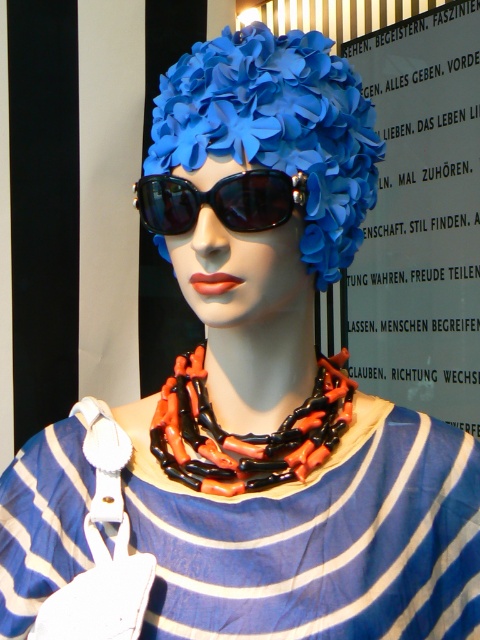
Question: Does matte plastic flowers at center appear over orange-black beaded necklace at center?

Choices:
 (A) no
 (B) yes

Answer: (B)

Question: Considering the relative positions of orange-black beaded necklace at center and black glossy sunglasses at center in the image provided, where is orange-black beaded necklace at center located with respect to black glossy sunglasses at center?

Choices:
 (A) right
 (B) left

Answer: (A)

Question: Which object is farther from the camera taking this photo?

Choices:
 (A) orange-black beaded necklace at center
 (B) black glossy sunglasses at center

Answer: (A)

Question: Which object is positioned closest to the blue striped fabric dress at center?

Choices:
 (A) matte plastic flowers at center
 (B) black glossy sunglasses at center

Answer: (A)

Question: Is orange-black beaded necklace at center to the right of black glossy sunglasses at center from the viewer's perspective?

Choices:
 (A) no
 (B) yes

Answer: (B)

Question: Which of the following is the farthest from the observer?

Choices:
 (A) black glossy sunglasses at center
 (B) orange-black beaded necklace at center
 (C) matte plastic flowers at center
 (D) blue striped fabric dress at center

Answer: (B)